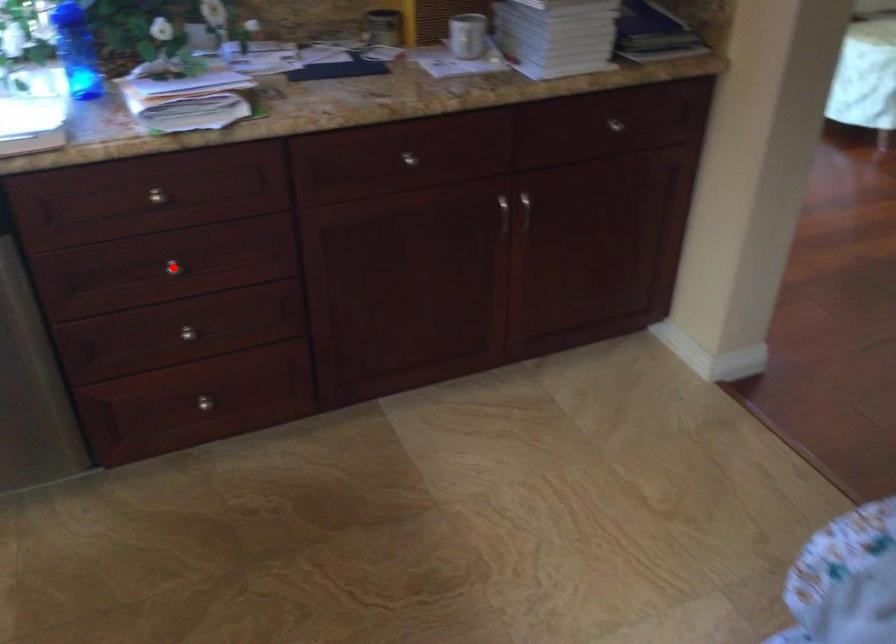
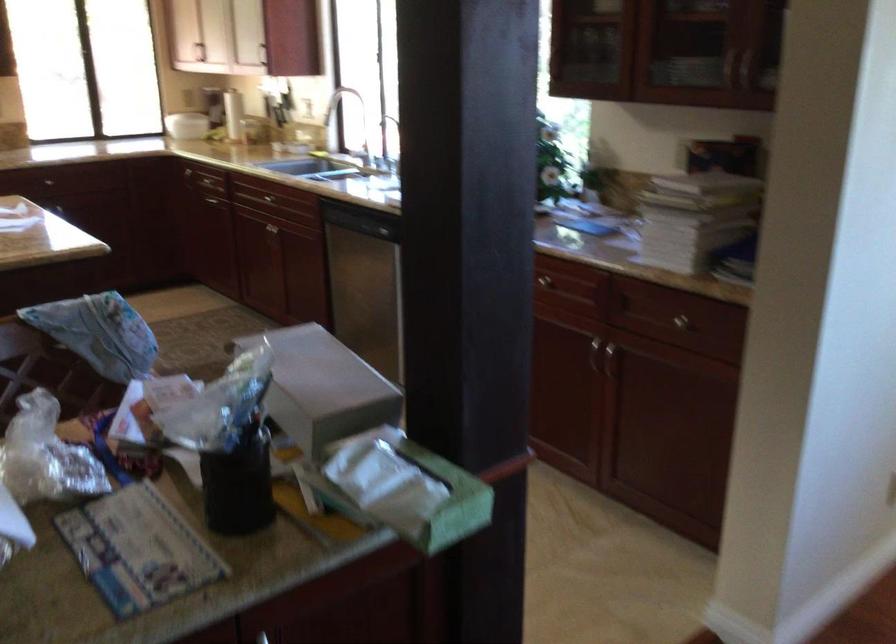
Question: I am providing you with two images of the same scene from different viewpoints. A red point is marked on the first image. Can you still see the location of the red point in image 2?

Choices:
 (A) Yes
 (B) No

Answer: (B)